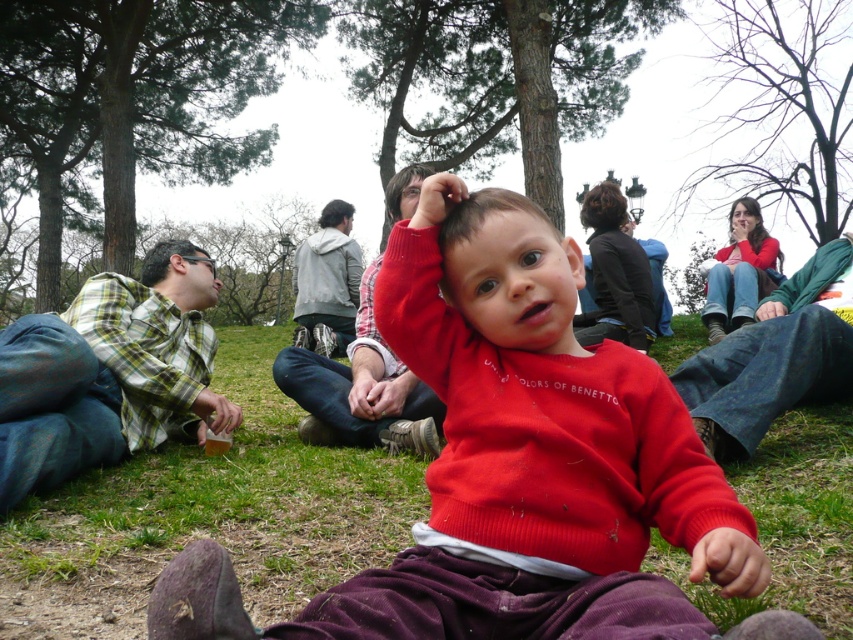
You are standing in the park and see the green plaid shirt at left. If you want to take a photo of it, where should you aim your camera?

You should aim your camera at point (105, 372) to capture the green plaid shirt at left.

You are a photographer trying to capture a photo of the green grass at center and the green plaid shirt at left. Based on their positions, which object is closer to the camera?

The green grass at center is closer to the camera because it is positioned below the green plaid shirt at left, indicating it is in the foreground.

You are a photographer setting up a shot in the park. You want to ensure the green grass at center and the green plaid shirt at left are both visible in the frame. Given their height differences, which object should be placed closer to the camera to maintain visibility?

The green grass at center is shorter than the green plaid shirt at left, so to ensure both are visible, the green grass at center should be placed closer to the camera.